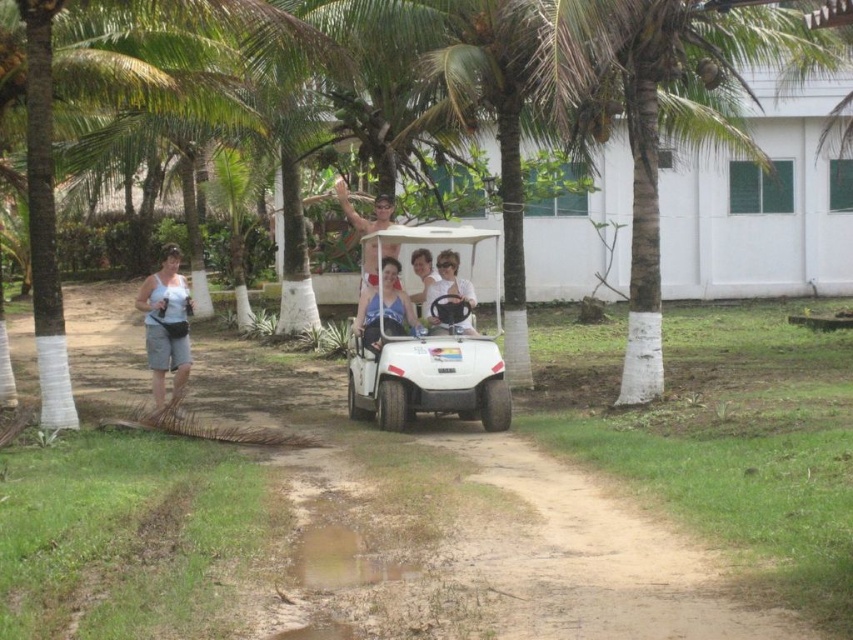
Question: Considering the relative positions of white fabric tank top at left and matte white golf cart at center in the image provided, where is white fabric tank top at left located with respect to matte white golf cart at center?

Choices:
 (A) above
 (B) below

Answer: (B)

Question: Can you confirm if white fabric tank top at left is positioned above matte white shirt at center?

Choices:
 (A) yes
 (B) no

Answer: (A)

Question: Based on their relative distances, which object is nearer to the matte white shirt at center?

Choices:
 (A) matte white steering wheel at center
 (B) white matte golf cart at center
 (C) matte blue shirt at center
 (D) white fabric tank top at left

Answer: (A)

Question: Which point appears closest to the camera in this image?

Choices:
 (A) (674, 616)
 (B) (460, 284)

Answer: (A)

Question: Which of the following is the farthest from the observer?

Choices:
 (A) (314, 412)
 (B) (415, 273)
 (C) (148, 330)
 (D) (454, 262)

Answer: (B)

Question: Does white matte golf cart at center lie behind matte blue shirt at center?

Choices:
 (A) yes
 (B) no

Answer: (B)